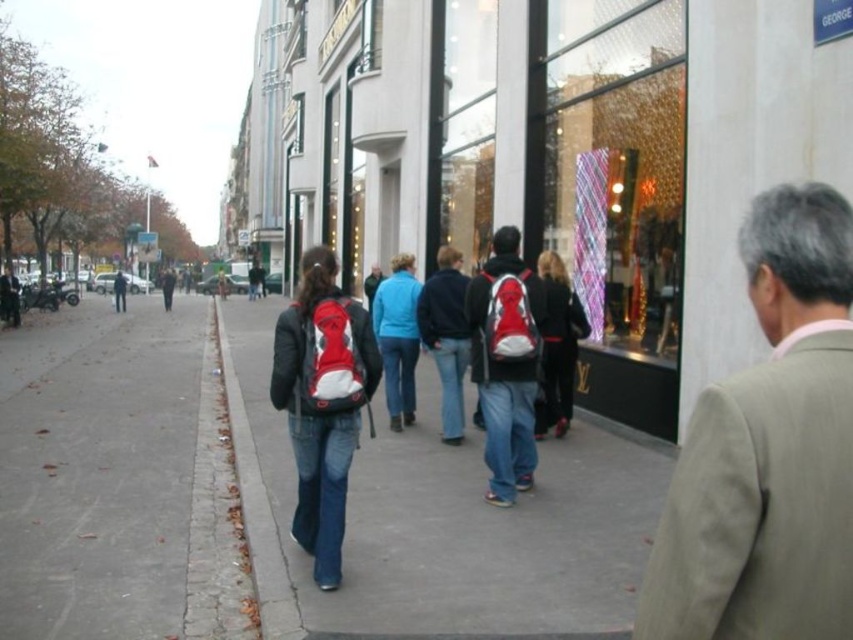
Question: Which of the following is the farthest from the observer?

Choices:
 (A) black synthetic backpack at center
 (B) denim at center

Answer: (A)

Question: Which of these objects is positioned closest to the black synthetic backpack at center?

Choices:
 (A) translucent glass display at center
 (B) denim jacket at center
 (C) matte red backpack at center
 (D) matte black jacket at center

Answer: (D)

Question: Is denim at center to the right of matte red backpack at center from the viewer's perspective?

Choices:
 (A) no
 (B) yes

Answer: (A)

Question: Which object is closer to the camera taking this photo?

Choices:
 (A) red backpack at center
 (B) blue fleece jacket at center
 (C) translucent glass display at center
 (D) gray concrete sidewalk at left

Answer: (D)

Question: Does denim at center appear over matte black backpack at center?

Choices:
 (A) yes
 (B) no

Answer: (B)

Question: Is gray concrete sidewalk at left to the left of red backpack at center from the viewer's perspective?

Choices:
 (A) yes
 (B) no

Answer: (B)